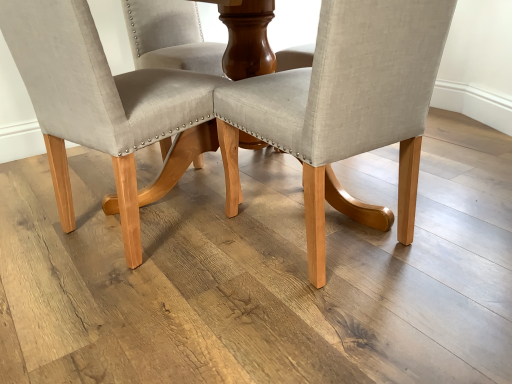
Locate an element on the screen. The image size is (512, 384). beige fabric chair at center, the 2th chair from the right is located at coordinates (105, 106).

This screenshot has height=384, width=512. Describe the element at coordinates (105, 106) in the screenshot. I see `beige fabric chair at center, which appears as the first chair when viewed from the left` at that location.

What is the approximate width of beige fabric chair at center, the 2th chair from the right?

The width of beige fabric chair at center, the 2th chair from the right, is 22.52 inches.

Describe the element at coordinates (344, 108) in the screenshot. This screenshot has height=384, width=512. I see `beige fabric chair at center, placed as the 1th chair when sorted from right to left` at that location.

I want to click on beige fabric chair at center, which ranks as the second chair in left-to-right order, so click(x=344, y=108).

This screenshot has width=512, height=384. I want to click on beige fabric chair at center, which appears as the first chair when viewed from the left, so click(x=105, y=106).

Can you confirm if beige fabric chair at center, which ranks as the second chair in left-to-right order, is positioned to the right of beige fabric chair at center, which appears as the first chair when viewed from the left?

Correct, you'll find beige fabric chair at center, which ranks as the second chair in left-to-right order, to the right of beige fabric chair at center, which appears as the first chair when viewed from the left.

Is beige fabric chair at center, which ranks as the second chair in left-to-right order, in front of or behind beige fabric chair at center, which appears as the first chair when viewed from the left, in the image?

Visually, beige fabric chair at center, which ranks as the second chair in left-to-right order, is located in front of beige fabric chair at center, which appears as the first chair when viewed from the left.

Is point (325, 12) farther from camera compared to point (10, 7)?

No, (325, 12) is in front of (10, 7).

Looking at this image, from the image's perspective, is beige fabric chair at center, which ranks as the second chair in left-to-right order, positioned above or below beige fabric chair at center, which appears as the first chair when viewed from the left?

beige fabric chair at center, which ranks as the second chair in left-to-right order, is below beige fabric chair at center, which appears as the first chair when viewed from the left.

From a real-world perspective, is beige fabric chair at center, placed as the 1th chair when sorted from right to left, under beige fabric chair at center, the 2th chair from the right?

Correct, in the physical world, beige fabric chair at center, placed as the 1th chair when sorted from right to left, is lower than beige fabric chair at center, the 2th chair from the right.

Considering the sizes of objects beige fabric chair at center, which ranks as the second chair in left-to-right order, and beige fabric chair at center, which appears as the first chair when viewed from the left, in the image provided, who is wider, beige fabric chair at center, which ranks as the second chair in left-to-right order, or beige fabric chair at center, which appears as the first chair when viewed from the left,?

beige fabric chair at center, which appears as the first chair when viewed from the left.

Between beige fabric chair at center, which ranks as the second chair in left-to-right order, and beige fabric chair at center, the 2th chair from the right, which one has less height?

beige fabric chair at center, which ranks as the second chair in left-to-right order.

Can you confirm if beige fabric chair at center, placed as the 1th chair when sorted from right to left, is bigger than beige fabric chair at center, which appears as the first chair when viewed from the left?

No, beige fabric chair at center, placed as the 1th chair when sorted from right to left, is not bigger than beige fabric chair at center, which appears as the first chair when viewed from the left.

Consider the image. Is beige fabric chair at center, placed as the 1th chair when sorted from right to left, not inside beige fabric chair at center, which appears as the first chair when viewed from the left?

beige fabric chair at center, placed as the 1th chair when sorted from right to left, is positioned outside beige fabric chair at center, which appears as the first chair when viewed from the left.

Is beige fabric chair at center, placed as the 1th chair when sorted from right to left, far away from beige fabric chair at center, the 2th chair from the right?

No.

Is beige fabric chair at center, placed as the 1th chair when sorted from right to left, aimed at beige fabric chair at center, the 2th chair from the right?

Result: No, beige fabric chair at center, placed as the 1th chair when sorted from right to left, does not turn towards beige fabric chair at center, the 2th chair from the right.

How many degrees apart are the facing directions of beige fabric chair at center, placed as the 1th chair when sorted from right to left, and beige fabric chair at center, the 2th chair from the right?

The facing directions of beige fabric chair at center, placed as the 1th chair when sorted from right to left, and beige fabric chair at center, the 2th chair from the right, are 68.2 degrees apart.

Could you measure the distance between beige fabric chair at center, which ranks as the second chair in left-to-right order, and beige fabric chair at center, the 2th chair from the right?

The distance of beige fabric chair at center, which ranks as the second chair in left-to-right order, from beige fabric chair at center, the 2th chair from the right, is 15.08 inches.

Locate an element on the screen. This screenshot has height=384, width=512. chair in front of the beige fabric chair at center, which appears as the first chair when viewed from the left is located at coordinates (344, 108).

Is beige fabric chair at center, which appears as the first chair when viewed from the left, to the left of beige fabric chair at center, which ranks as the second chair in left-to-right order, from the viewer's perspective?

Yes, beige fabric chair at center, which appears as the first chair when viewed from the left, is to the left of beige fabric chair at center, which ranks as the second chair in left-to-right order.

Between beige fabric chair at center, the 2th chair from the right, and beige fabric chair at center, which ranks as the second chair in left-to-right order, which one is positioned behind?

beige fabric chair at center, the 2th chair from the right, is more distant.

Does point (40, 87) come in front of point (365, 105)?

No, (40, 87) is further to viewer.

From the image's perspective, who appears lower, beige fabric chair at center, the 2th chair from the right, or beige fabric chair at center, which ranks as the second chair in left-to-right order?

beige fabric chair at center, which ranks as the second chair in left-to-right order.

From a real-world perspective, is beige fabric chair at center, which appears as the first chair when viewed from the left, under beige fabric chair at center, which ranks as the second chair in left-to-right order?

No.

Considering the sizes of objects beige fabric chair at center, the 2th chair from the right, and beige fabric chair at center, placed as the 1th chair when sorted from right to left, in the image provided, who is wider, beige fabric chair at center, the 2th chair from the right, or beige fabric chair at center, placed as the 1th chair when sorted from right to left,?

Wider between the two is beige fabric chair at center, the 2th chair from the right.

Is beige fabric chair at center, the 2th chair from the right, shorter than beige fabric chair at center, placed as the 1th chair when sorted from right to left?

Incorrect, the height of beige fabric chair at center, the 2th chair from the right, does not fall short of that of beige fabric chair at center, placed as the 1th chair when sorted from right to left.

Which of these two, beige fabric chair at center, the 2th chair from the right, or beige fabric chair at center, placed as the 1th chair when sorted from right to left, is bigger?

Bigger between the two is beige fabric chair at center, the 2th chair from the right.

Would you say beige fabric chair at center, the 2th chair from the right, is outside beige fabric chair at center, placed as the 1th chair when sorted from right to left?

Yes, beige fabric chair at center, the 2th chair from the right, is not within beige fabric chair at center, placed as the 1th chair when sorted from right to left.

Is beige fabric chair at center, the 2th chair from the right, far from beige fabric chair at center, placed as the 1th chair when sorted from right to left?

beige fabric chair at center, the 2th chair from the right, is near beige fabric chair at center, placed as the 1th chair when sorted from right to left, not far away.

Could you tell me if beige fabric chair at center, the 2th chair from the right, is facing beige fabric chair at center, which ranks as the second chair in left-to-right order?

No, beige fabric chair at center, the 2th chair from the right, is not oriented towards beige fabric chair at center, which ranks as the second chair in left-to-right order.

How different are the orientations of beige fabric chair at center, which appears as the first chair when viewed from the left, and beige fabric chair at center, which ranks as the second chair in left-to-right order, in degrees?

The angle between the facing direction of beige fabric chair at center, which appears as the first chair when viewed from the left, and the facing direction of beige fabric chair at center, which ranks as the second chair in left-to-right order, is 68.2 degrees.

The image size is (512, 384). I want to click on chair to the right of beige fabric chair at center, which appears as the first chair when viewed from the left, so click(x=344, y=108).

Where is `chair behind the beige fabric chair at center, placed as the 1th chair when sorted from right to left`? Image resolution: width=512 pixels, height=384 pixels. chair behind the beige fabric chair at center, placed as the 1th chair when sorted from right to left is located at coordinates (105, 106).

You are a GUI agent. You are given a task and a screenshot of the screen. Output one action in this format:
    pyautogui.click(x=<x>, y=<y>)
    Task: Click on the chair below the beige fabric chair at center, the 2th chair from the right (from the image's perspective)
    The height and width of the screenshot is (384, 512).
    Given the screenshot: What is the action you would take?
    pyautogui.click(x=344, y=108)